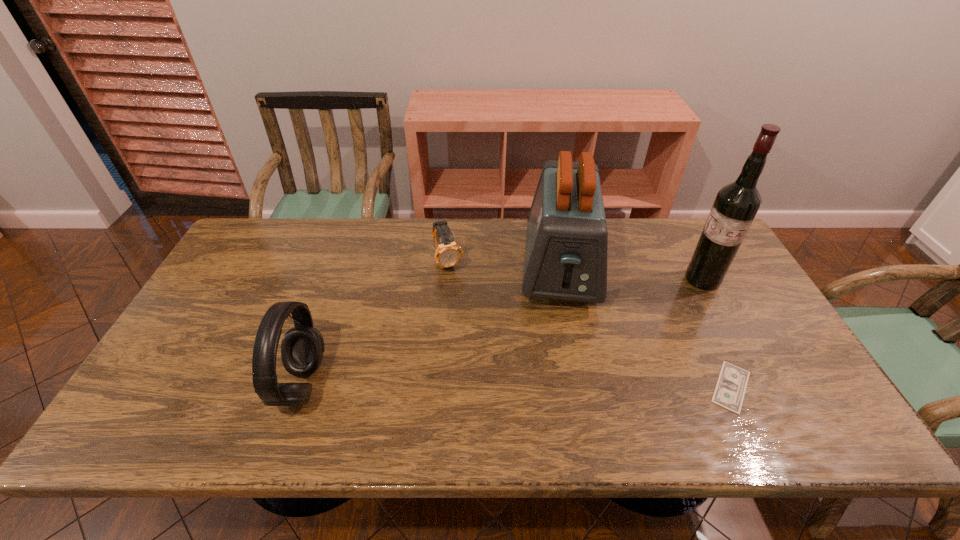
This screenshot has width=960, height=540. I want to click on headset, so click(302, 347).

Where is `the leftmost object`? This screenshot has height=540, width=960. the leftmost object is located at coordinates (302, 347).

Locate an element on the screen. the shortest object is located at coordinates (729, 392).

Where is `watch`? watch is located at coordinates (448, 253).

Identify the location of the fourth object from right to left. (448, 253).

This screenshot has height=540, width=960. Find the location of `the fourth shortest object`. the fourth shortest object is located at coordinates (566, 249).

The width and height of the screenshot is (960, 540). I want to click on the third object from right to left, so click(x=566, y=249).

The width and height of the screenshot is (960, 540). In order to click on wine bottle in this screenshot , I will do `click(736, 205)`.

At what (x,y) coordinates should I click in order to perform the action: click on free space located on the earcups of the third shortest object. Please return your answer as a coordinate pair (x, y). Looking at the image, I should click on (355, 384).

The image size is (960, 540). Identify the location of vacant space situated on the back of the shortest object. click(681, 282).